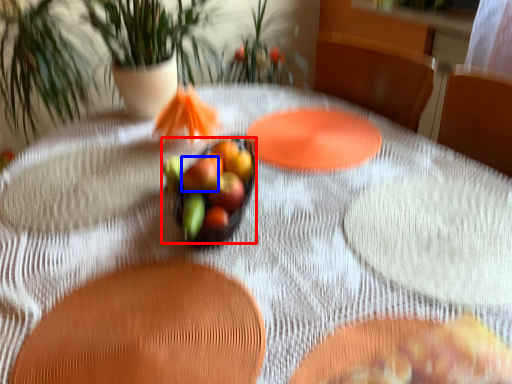
Question: Which point is further to the camera, grapefruit (highlighted by a red box) or flower (highlighted by a blue box)?

Choices:
 (A) grapefruit
 (B) flower

Answer: (B)